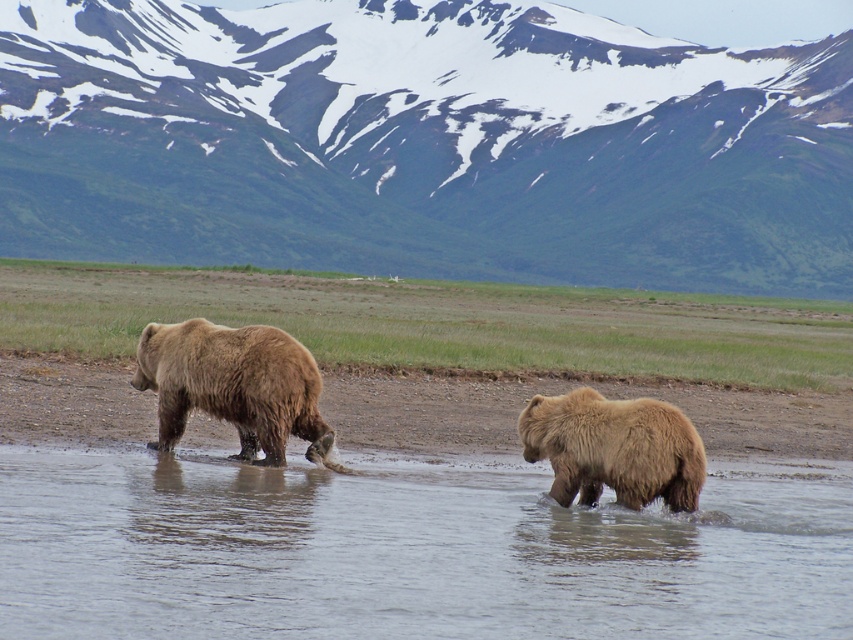
Question: Estimate the real-world distances between objects in this image. Which object is closer to the snowy rock mountain at upper center?

Choices:
 (A) fuzzy brown bear at left
 (B) clear water at lower center

Answer: (B)

Question: From the image, what is the correct spatial relationship of snowy rock mountain at upper center in relation to brown furry bear at right?

Choices:
 (A) below
 (B) above

Answer: (B)

Question: Among these objects, which one is nearest to the camera?

Choices:
 (A) fuzzy brown bear at left
 (B) snowy rock mountain at upper center
 (C) clear water at lower center
 (D) brown furry bear at right

Answer: (C)

Question: Can you confirm if snowy rock mountain at upper center is smaller than clear water at lower center?

Choices:
 (A) yes
 (B) no

Answer: (B)

Question: Does snowy rock mountain at upper center appear under clear water at lower center?

Choices:
 (A) no
 (B) yes

Answer: (A)

Question: Considering the real-world distances, which object is closest to the snowy rock mountain at upper center?

Choices:
 (A) brown furry bear at right
 (B) fuzzy brown bear at left
 (C) clear water at lower center

Answer: (C)